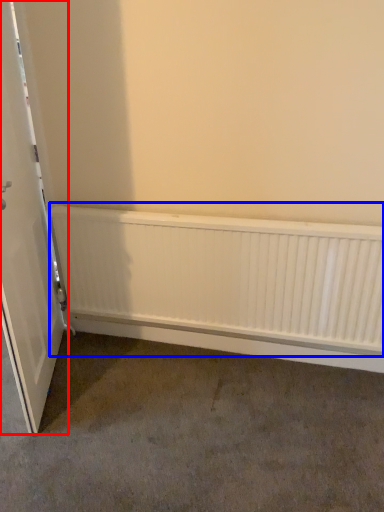
Question: Which object is closer to the camera taking this photo, door (highlighted by a red box) or radiator (highlighted by a blue box)?

Choices:
 (A) door
 (B) radiator

Answer: (A)